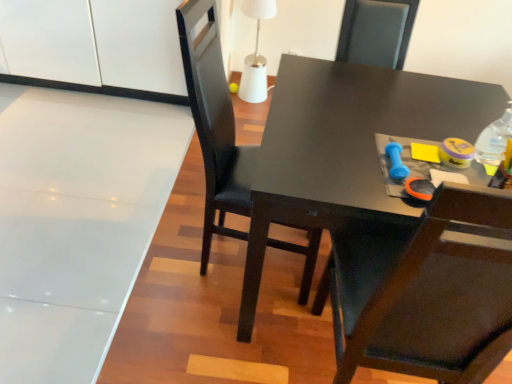
This screenshot has width=512, height=384. I want to click on free space to the back side of transparent plastic bottle at upper right, so click(454, 122).